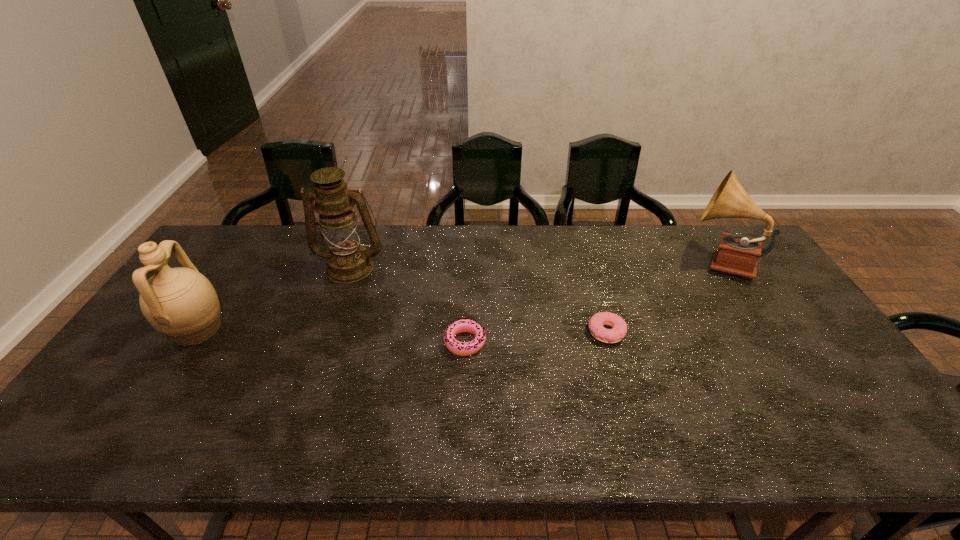
Where is `free location located 0.350m on the left of the right doughnut`? The image size is (960, 540). free location located 0.350m on the left of the right doughnut is located at coordinates (462, 333).

Where is `free region located 0.190m on the left of the left doughnut`? Image resolution: width=960 pixels, height=540 pixels. free region located 0.190m on the left of the left doughnut is located at coordinates (374, 342).

The image size is (960, 540). In order to click on oil lamp situated at the far edge in this screenshot , I will do `click(348, 261)`.

The width and height of the screenshot is (960, 540). In order to click on phonograph record at the far edge in this screenshot , I will do `click(737, 254)`.

The width and height of the screenshot is (960, 540). What are the coordinates of `object that is at the left edge` in the screenshot? It's located at (180, 303).

Find the location of a particular element. The image size is (960, 540). object situated at the right edge is located at coordinates click(737, 254).

I want to click on object present at the far right corner, so click(x=737, y=254).

The image size is (960, 540). I want to click on free region at the far edge of the desktop, so click(x=469, y=242).

Image resolution: width=960 pixels, height=540 pixels. What are the coordinates of `vacant space at the near edge of the desktop` in the screenshot? It's located at (376, 443).

In the image, there is a desktop. Identify the location of vacant area at the right edge. The height and width of the screenshot is (540, 960). (821, 338).